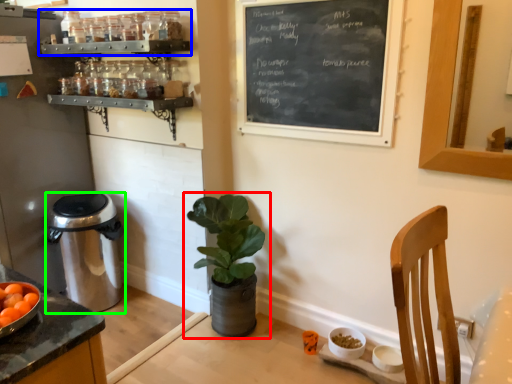
Question: Considering the real-world distances, which object is farthest from houseplant (highlighted by a red box)? shelf (highlighted by a blue box) or trash bin/can (highlighted by a green box)?

Choices:
 (A) shelf
 (B) trash bin/can

Answer: (A)